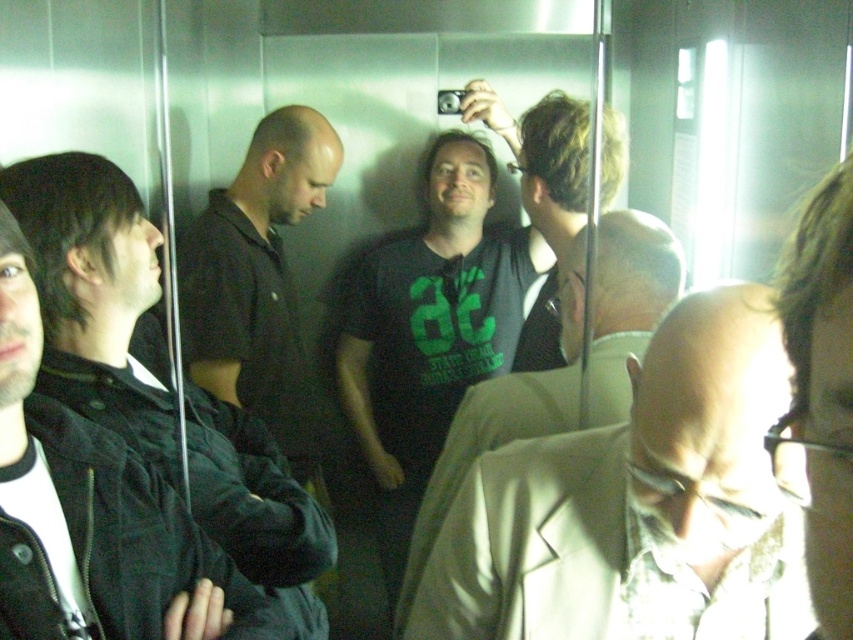
Does point (132, 340) come in front of point (221, 256)?

Yes, it is.

Describe the element at coordinates (96, 296) in the screenshot. This screenshot has width=853, height=640. I see `black quilted jacket at left` at that location.

Where is `black quilted jacket at left`? black quilted jacket at left is located at coordinates (96, 296).

How distant is dark green t-shirt at center from black matte shirt at left?

dark green t-shirt at center is 14.76 inches away from black matte shirt at left.

Which is behind, point (469, 292) or point (254, 308)?

Point (469, 292)

Find the location of a particular element. dark green t-shirt at center is located at coordinates (430, 330).

From the picture: Is the position of black matte shirt at left less distant than that of dark brown hair at upper right?

That is False.

Is black matte shirt at left taller than dark brown hair at upper right?

Yes, black matte shirt at left is taller than dark brown hair at upper right.

Between point (254, 374) and point (824, 625), which one is positioned in front?

Point (824, 625) is in front.

I want to click on black matte shirt at left, so click(253, 262).